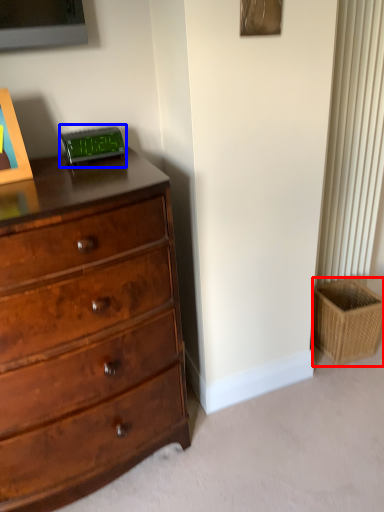
Question: Which object is closer to the camera taking this photo, basket (highlighted by a red box) or alarm clock (highlighted by a blue box)?

Choices:
 (A) basket
 (B) alarm clock

Answer: (B)